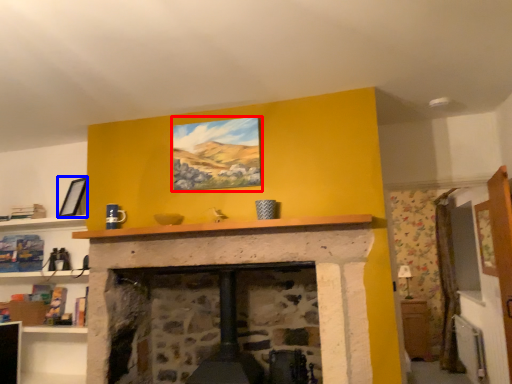
Question: Which object is further to the camera taking this photo, picture frame (highlighted by a red box) or picture frame (highlighted by a blue box)?

Choices:
 (A) picture frame
 (B) picture frame

Answer: (B)